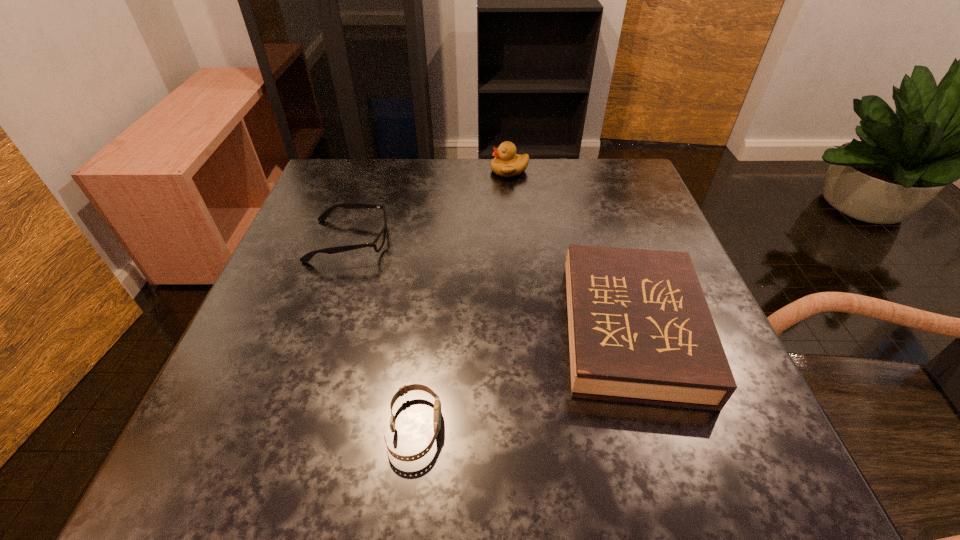
This screenshot has width=960, height=540. I want to click on vacant space located on the back of the third shortest object, so click(588, 196).

This screenshot has width=960, height=540. I want to click on free space located on the front-facing side of the third nearest object, so click(412, 241).

Where is `free space located 0.340m on the face of the watch`? This screenshot has width=960, height=540. free space located 0.340m on the face of the watch is located at coordinates (675, 428).

This screenshot has height=540, width=960. I want to click on object situated at the far edge, so click(507, 163).

Find the location of a particular element. The height and width of the screenshot is (540, 960). object at the near edge is located at coordinates (437, 404).

You are a GUI agent. You are given a task and a screenshot of the screen. Output one action in this format:
    pyautogui.click(x=<x>, y=<y>)
    Task: Click on the object located at the left edge
    
    Given the screenshot: What is the action you would take?
    pyautogui.click(x=378, y=243)

What are the coordinates of `object that is at the right edge` in the screenshot? It's located at (640, 330).

Identify the location of vacant area at the far edge. This screenshot has height=540, width=960. (401, 176).

Locate an element on the screen. vacant space at the left edge is located at coordinates (340, 309).

In the image, there is a desktop. Where is `vacant space at the right edge`? The image size is (960, 540). vacant space at the right edge is located at coordinates (588, 216).